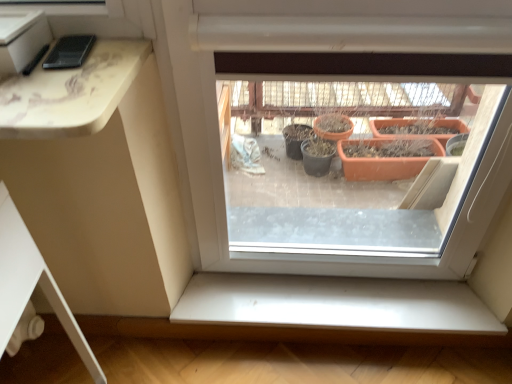
Question: Would you consider white smooth window sill at lower center to be distant from matte black phone at upper left?

Choices:
 (A) yes
 (B) no

Answer: (B)

Question: From the image's perspective, is white smooth window sill at lower center below matte black phone at upper left?

Choices:
 (A) yes
 (B) no

Answer: (A)

Question: Is the position of white smooth window sill at lower center less distant than that of matte black phone at upper left?

Choices:
 (A) yes
 (B) no

Answer: (B)

Question: Can you confirm if white smooth window sill at lower center is shorter than matte black phone at upper left?

Choices:
 (A) no
 (B) yes

Answer: (A)

Question: Is white smooth window sill at lower center to the left of matte black phone at upper left from the viewer's perspective?

Choices:
 (A) yes
 (B) no

Answer: (B)

Question: Is matte black phone at upper left at the back of white smooth window sill at lower center?

Choices:
 (A) no
 (B) yes

Answer: (A)

Question: Is matte black phone at upper left thinner than white smooth window sill at lower center?

Choices:
 (A) yes
 (B) no

Answer: (A)

Question: From a real-world perspective, does matte black phone at upper left sit lower than white smooth window sill at lower center?

Choices:
 (A) no
 (B) yes

Answer: (A)

Question: Are matte black phone at upper left and white smooth window sill at lower center beside each other?

Choices:
 (A) yes
 (B) no

Answer: (B)

Question: Is matte black phone at upper left at the left side of white smooth window sill at lower center?

Choices:
 (A) no
 (B) yes

Answer: (B)

Question: Is matte black phone at upper left smaller than white smooth window sill at lower center?

Choices:
 (A) yes
 (B) no

Answer: (A)

Question: Does matte black phone at upper left have a greater width compared to white smooth window sill at lower center?

Choices:
 (A) no
 (B) yes

Answer: (A)

Question: Looking at the image, does white smooth window sill at lower center seem bigger or smaller compared to matte black phone at upper left?

Choices:
 (A) small
 (B) big

Answer: (B)